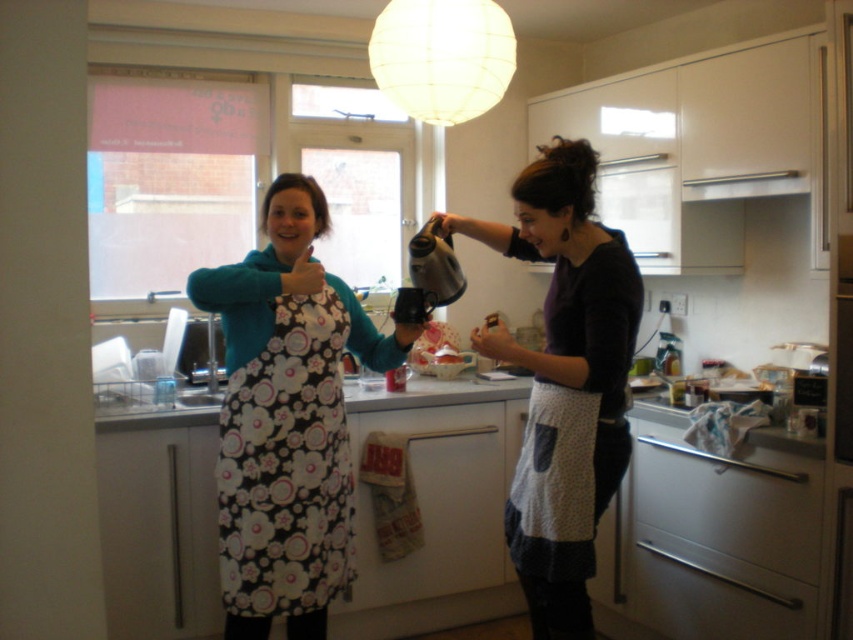
Question: Which of these objects is positioned farthest from the white dotted apron at lower center?

Choices:
 (A) white dotted apron at center
 (B) floral fabric apron at left
 (C) floral fabric apron at center
 (D) white glossy exhaust hood at upper center

Answer: (D)

Question: Which object is the closest to the floral fabric apron at center?

Choices:
 (A) white matte lampshade at upper center
 (B) white glossy exhaust hood at upper center
 (C) white dotted apron at center

Answer: (C)

Question: Is floral fabric apron at center bigger than white dotted apron at center?

Choices:
 (A) yes
 (B) no

Answer: (B)

Question: Which of the following is the closest to the observer?

Choices:
 (A) (322, 563)
 (B) (433, 77)
 (C) (718, 186)

Answer: (A)

Question: Is floral fabric apron at center smaller than white dotted apron at lower center?

Choices:
 (A) no
 (B) yes

Answer: (A)

Question: Is floral fabric apron at center smaller than white dotted apron at lower center?

Choices:
 (A) yes
 (B) no

Answer: (B)